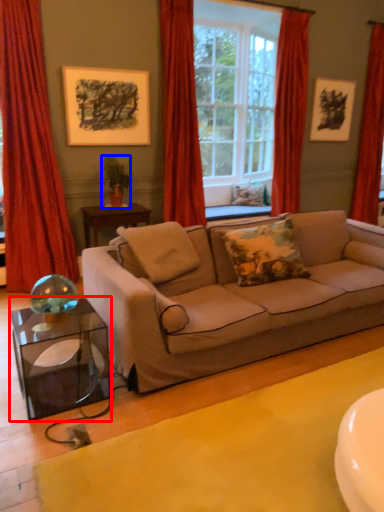
Question: Which object appears closest to the camera in this image, table (highlighted by a red box) or houseplant (highlighted by a blue box)?

Choices:
 (A) table
 (B) houseplant

Answer: (A)